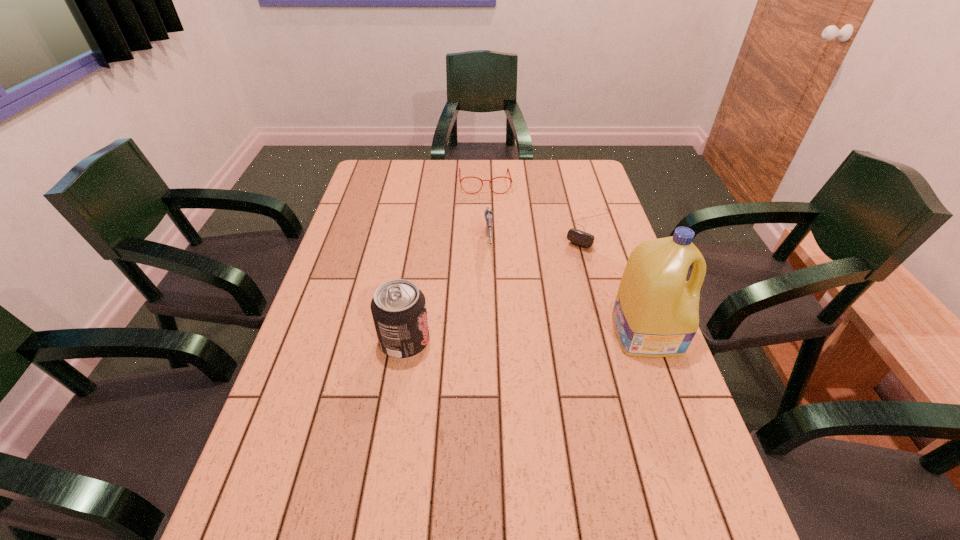
Identify the location of vacant space at the far edge of the desktop. (424, 177).

At what (x,y) coordinates should I click in order to perform the action: click on vacant region at the left edge. Please return your answer as a coordinate pair (x, y). Looking at the image, I should click on (398, 201).

You are a GUI agent. You are given a task and a screenshot of the screen. Output one action in this format:
    pyautogui.click(x=<x>, y=<y>)
    Task: Click on the vacant space at the right edge of the desktop
    
    Given the screenshot: What is the action you would take?
    pyautogui.click(x=584, y=206)

Where is `vacant area at the far left corner`? This screenshot has height=540, width=960. vacant area at the far left corner is located at coordinates (407, 166).

Where is `free space at the near right corner`? free space at the near right corner is located at coordinates (686, 492).

This screenshot has width=960, height=540. What are the coordinates of `vacant point located between the tallest object and the fourth shortest object` in the screenshot? It's located at (525, 336).

What are the coordinates of `vacant space that's between the soda can and the detergent` in the screenshot? It's located at (525, 336).

Where is `empty location between the soda can and the third shortest object`? The width and height of the screenshot is (960, 540). empty location between the soda can and the third shortest object is located at coordinates (446, 295).

This screenshot has height=540, width=960. I want to click on vacant area that lies between the detergent and the third shortest object, so click(567, 290).

The height and width of the screenshot is (540, 960). I want to click on vacant space that is in between the detergent and the second tallest object, so click(525, 336).